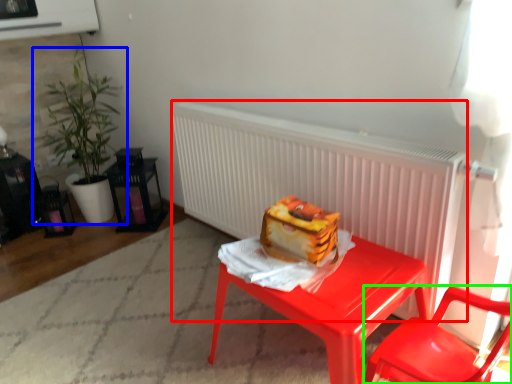
Question: Based on their relative distances, which object is farther from radiator (highlighted by a red box)? Choose from houseplant (highlighted by a blue box) and chair (highlighted by a green box).

Choices:
 (A) houseplant
 (B) chair

Answer: (A)